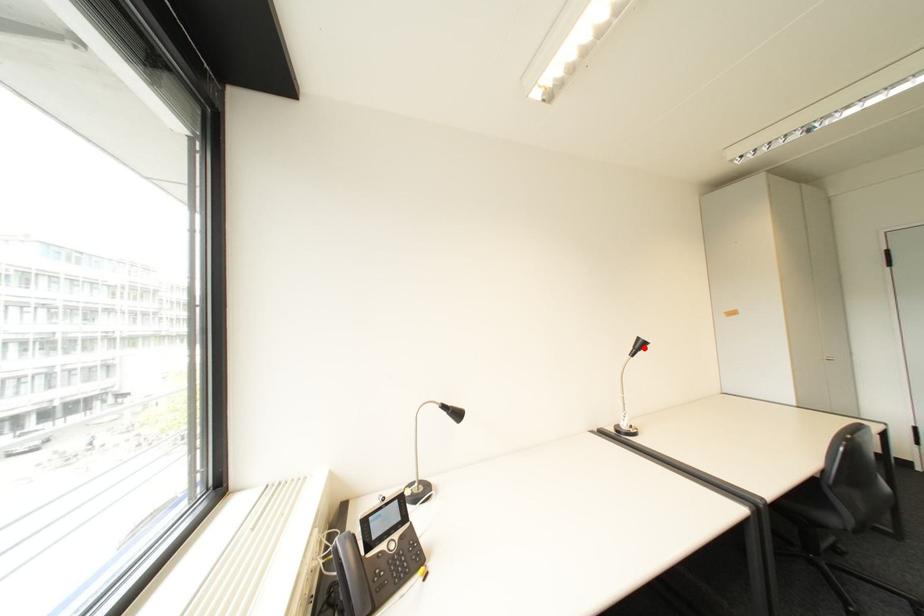
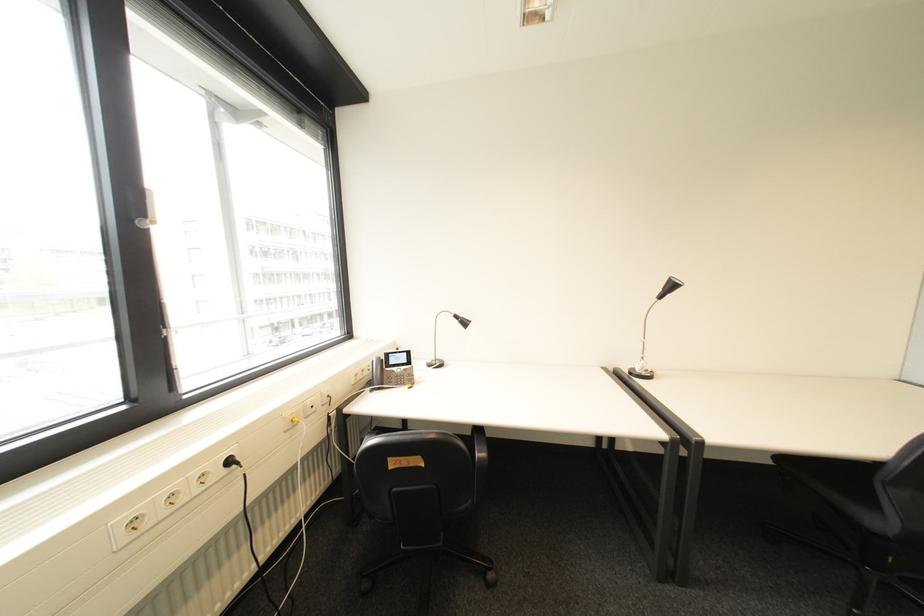
In the second image, find the point that corresponds to the highlighted location in the first image.

(673, 290)